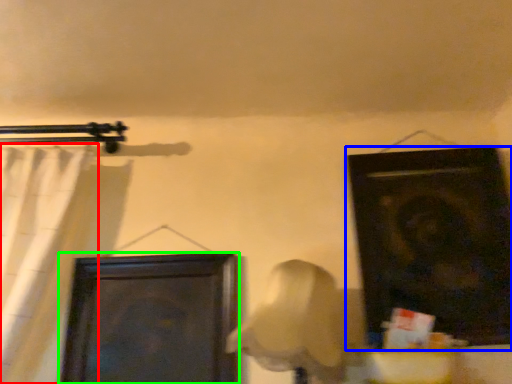
Question: Estimate the real-world distances between objects in this image. Which object is closer to curtain (highlighted by a red box), door (highlighted by a blue box) or door (highlighted by a green box)?

Choices:
 (A) door
 (B) door

Answer: (B)